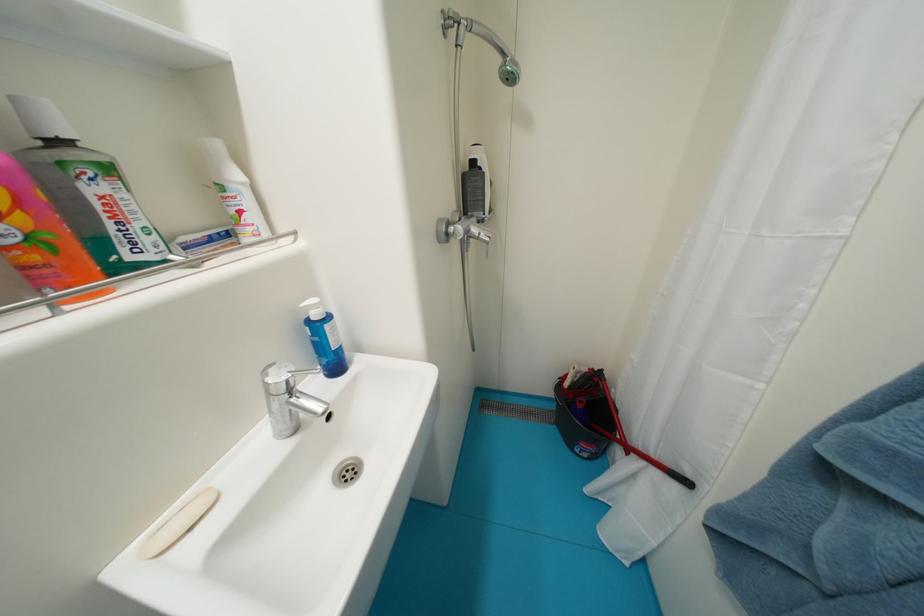
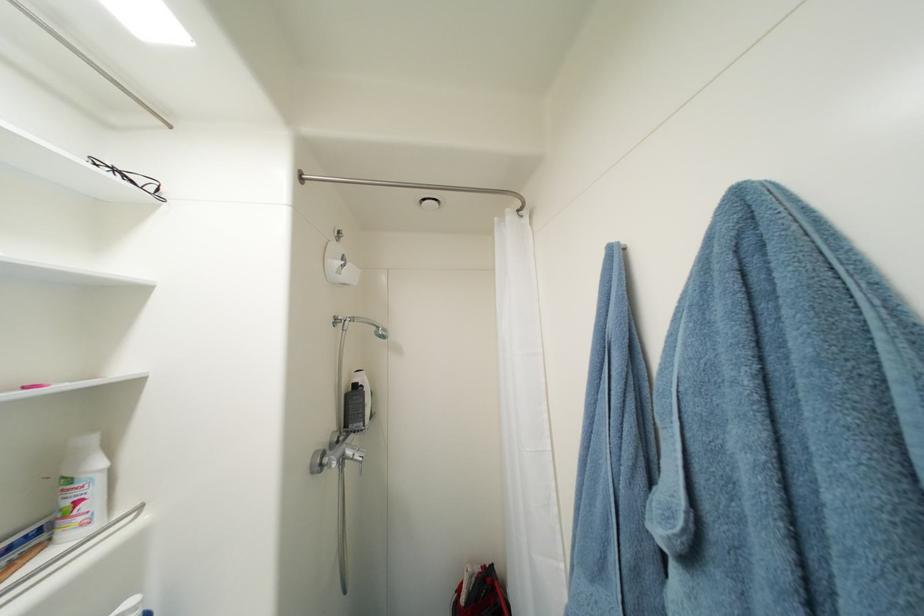
Where in the second image is the point corresponding to (x=573, y=387) from the first image?

(469, 602)